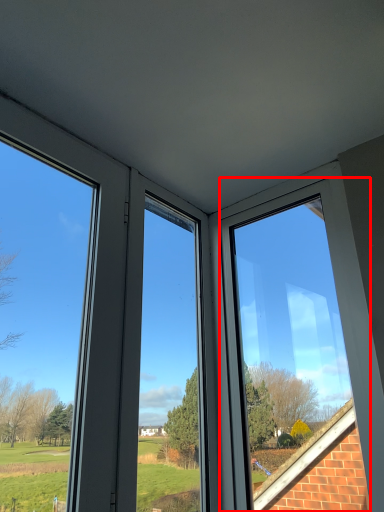
Question: From the image's perspective, what is the correct spatial positioning of window (annotated by the red box) in reference to window?

Choices:
 (A) above
 (B) below

Answer: (B)